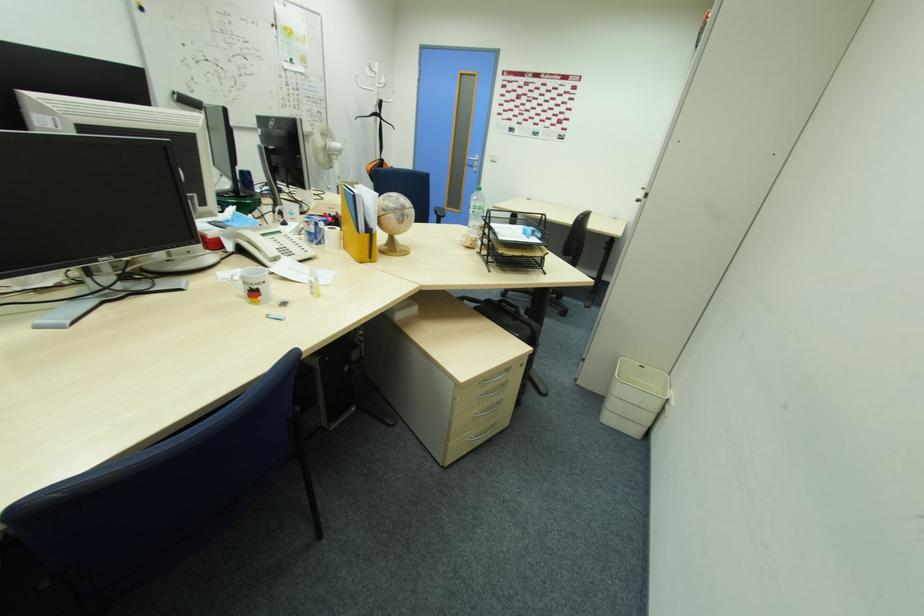
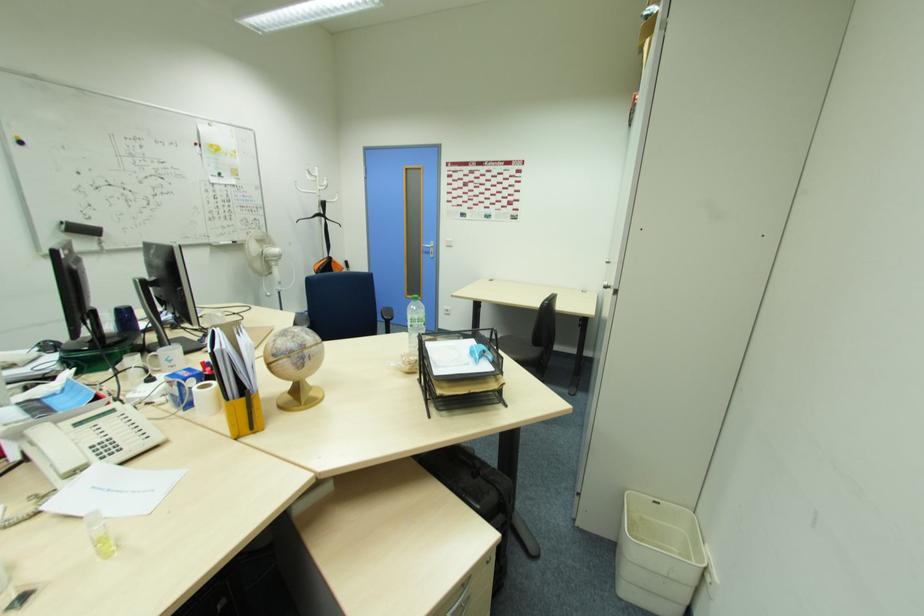
The point at (333, 229) is marked in the first image. Where is the corresponding point in the second image?

(204, 387)